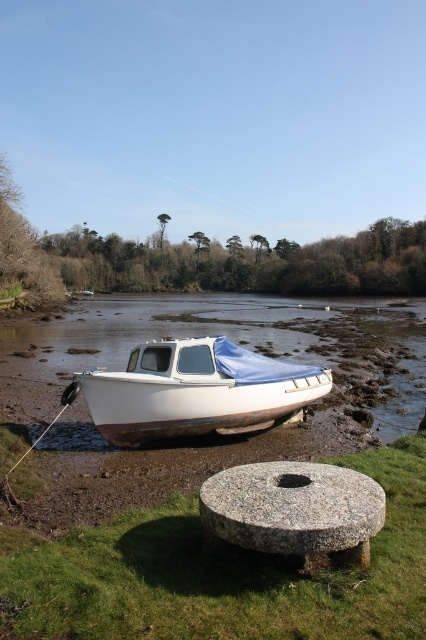
Find the location of `green grass at center`. green grass at center is located at coordinates (222, 573).

Consider the image. Does green grass at center have a larger size compared to granite millstone at lower center?

Yes.

The image size is (426, 640). Identify the location of green grass at center. (222, 573).

This screenshot has height=640, width=426. What do you see at coordinates (196, 390) in the screenshot?
I see `white matte boat at center` at bounding box center [196, 390].

Between point (164, 385) and point (344, 493), which one is positioned in front?

Point (344, 493) is in front.

Who is more distant from viewer, (118, 410) or (279, 522)?

The point (118, 410) is more distant.

This screenshot has width=426, height=640. What are the coordinates of `white matte boat at center` in the screenshot? It's located at (196, 390).

Who is lower down, green grass at center or white matte boat at center?

Positioned lower is green grass at center.

Can you confirm if green grass at center is positioned to the right of white matte boat at center?

Indeed, green grass at center is positioned on the right side of white matte boat at center.

Find the location of a particular element. The width and height of the screenshot is (426, 640). green grass at center is located at coordinates (222, 573).

Image resolution: width=426 pixels, height=640 pixels. What are the coordinates of `green grass at center` in the screenshot? It's located at (222, 573).